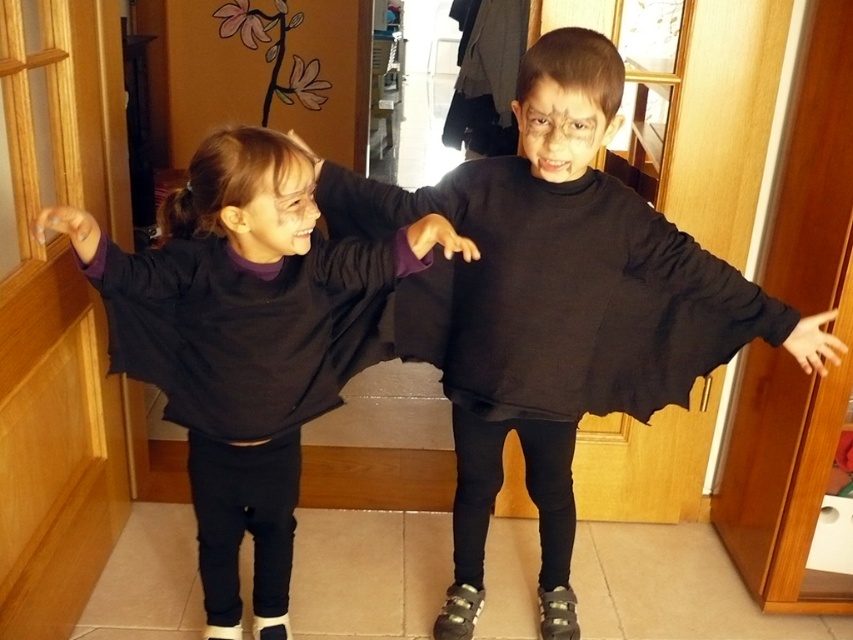
Question: Does black matte sweater at center appear on the right side of matte black sweater at center?

Choices:
 (A) no
 (B) yes

Answer: (B)

Question: Is the position of black matte sweater at center less distant than that of matte black sweater at center?

Choices:
 (A) no
 (B) yes

Answer: (A)

Question: Observing the image, what is the correct spatial positioning of black matte sweater at center in reference to matte black sweater at center?

Choices:
 (A) above
 (B) below

Answer: (A)

Question: Which point appears farthest from the camera in this image?

Choices:
 (A) (467, 410)
 (B) (100, 248)

Answer: (A)